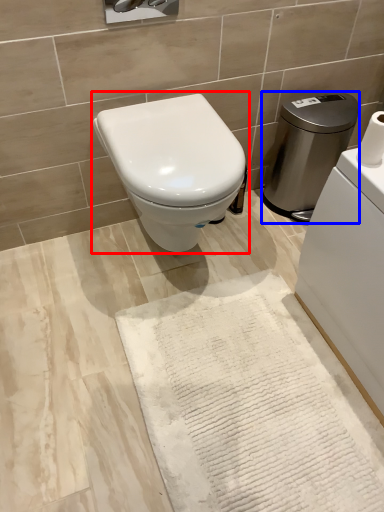
Question: Among these objects, which one is nearest to the camera, toilet (highlighted by a red box) or water heater (highlighted by a blue box)?

Choices:
 (A) toilet
 (B) water heater

Answer: (A)